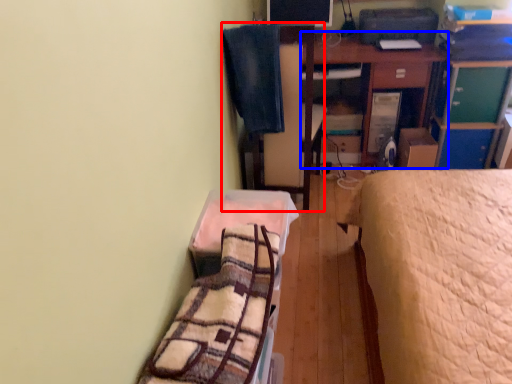
Question: Among these objects, which one is farthest to the camera, swivel chair (highlighted by a red box) or table (highlighted by a blue box)?

Choices:
 (A) swivel chair
 (B) table

Answer: (B)